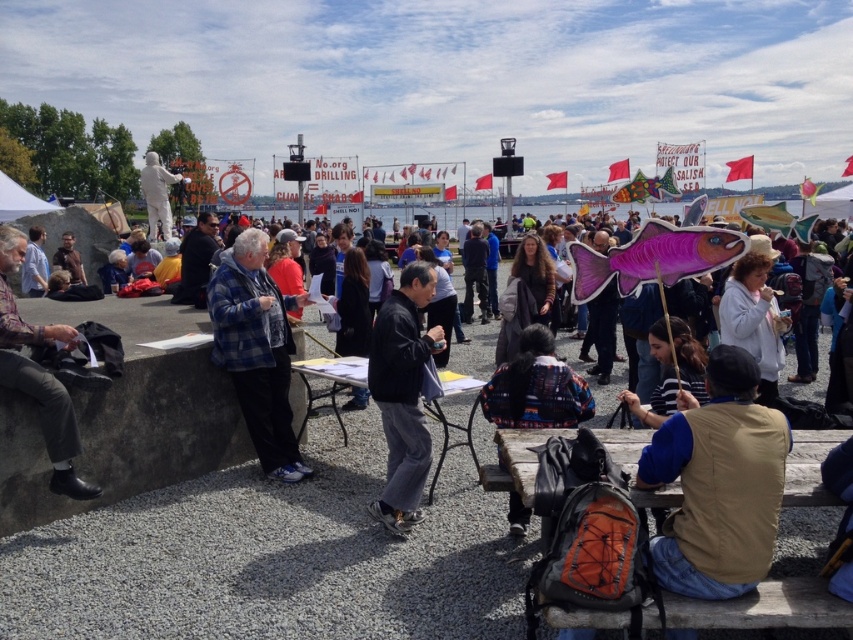
You are a photographer trying to capture both the brown suede vest at lower right and the blue plaid shirt at center in the same frame. Which of the two objects should you focus on first to ensure both are in focus?

The brown suede vest at lower right is closer to the viewer than the blue plaid shirt at center, so focus on the brown suede vest at lower right first to ensure both are in focus.

From the picture: You are a photographer trying to capture both the brown suede vest at lower right and the dark gray pants at left in a single frame. Considering their sizes, which one might appear closer to the camera in the photo?

The brown suede vest at lower right has a smaller size compared to the dark gray pants at left, so it might appear closer to the camera in the photo because smaller objects can sometimes be perceived as nearer in a two dimensional image.

You are standing at the point marked as point [257,349] in the image. What object are you touching?

You are touching the blue plaid shirt at center because the point [257,349] is located on it.